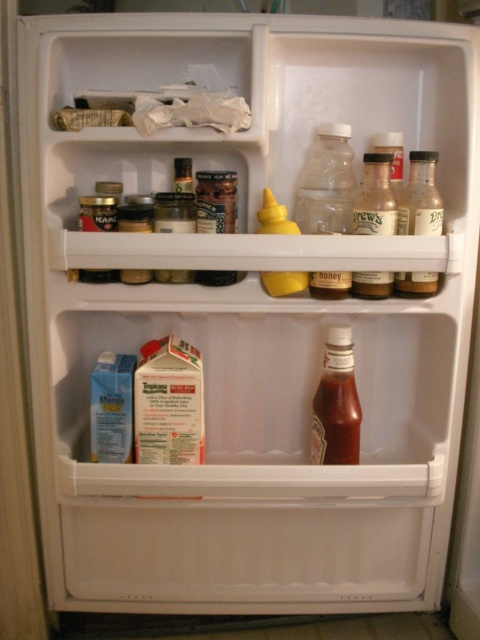
You are organizing the fridge and need to place a new bottle of sauce that requires a space larger than the yellow matte mustard at center. Is there enough space next to the clear glass bottle at upper right?

The clear glass bottle at upper right is bigger than the yellow matte mustard at center, so there is sufficient space next to the clear glass bottle at upper right to accommodate the new sauce bottle.

You are organizing the fridge and want to move the translucent glass jar at center to the front so it is more visible. Can you do this without moving the translucent plastic bottle at center?

The translucent glass jar at center is currently behind the translucent plastic bottle at center, so you cannot move it to the front without moving the translucent plastic bottle at center first.